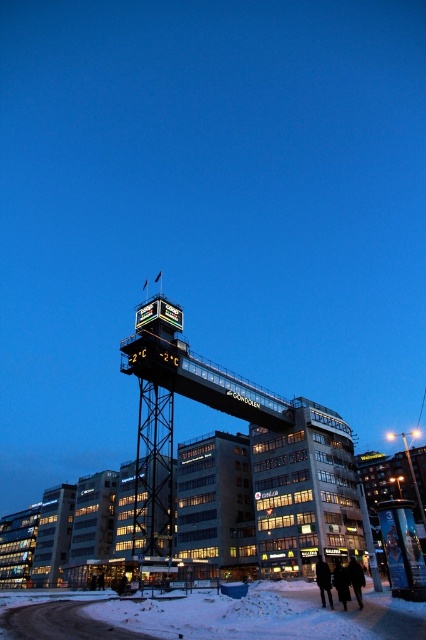
Question: Which object appears closest to the camera in this image?

Choices:
 (A) glassy transparent building at center
 (B) white powdery snow at lower center

Answer: (B)

Question: Which point is closer to the camera?

Choices:
 (A) white powdery snow at lower center
 (B) black fabric coat at lower center

Answer: (A)

Question: Does glassy transparent building at center appear over black wool coat at lower center?

Choices:
 (A) yes
 (B) no

Answer: (A)

Question: Which point is farther to the camera?

Choices:
 (A) (356, 572)
 (B) (321, 596)

Answer: (B)

Question: Does glassy transparent building at center come behind white powdery snow at lower center?

Choices:
 (A) no
 (B) yes

Answer: (B)

Question: Can you confirm if black wool coat at lower center is thinner than black fabric coat at lower center?

Choices:
 (A) no
 (B) yes

Answer: (B)